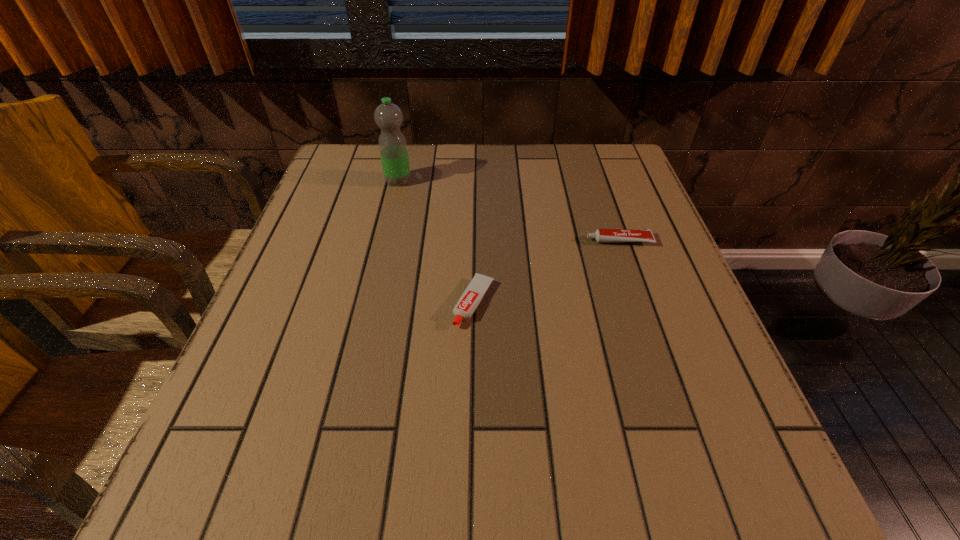
The image size is (960, 540). I want to click on the farthest object, so click(x=388, y=116).

The width and height of the screenshot is (960, 540). I want to click on water bottle, so click(388, 116).

I want to click on the second nearest object, so click(x=601, y=235).

The width and height of the screenshot is (960, 540). I want to click on the right toothpaste, so click(x=601, y=235).

Find the location of `the left toothpaste`. the left toothpaste is located at coordinates (472, 296).

This screenshot has width=960, height=540. Find the location of `the second object from right to left`. the second object from right to left is located at coordinates (472, 296).

What are the coordinates of `vacant space located on the left of the tallest object` in the screenshot? It's located at (366, 181).

In order to click on vacant space located at the nozzle of the right toothpaste in this screenshot , I will do `click(519, 241)`.

Image resolution: width=960 pixels, height=540 pixels. Find the location of `vacant region located 0.250m at the nozzle of the right toothpaste`. vacant region located 0.250m at the nozzle of the right toothpaste is located at coordinates (475, 241).

You are a GUI agent. You are given a task and a screenshot of the screen. Output one action in this format:
    pyautogui.click(x=<x>, y=<y>)
    Task: Click on the free space located at the nozzle of the right toothpaste
    
    Given the screenshot: What is the action you would take?
    pyautogui.click(x=448, y=241)